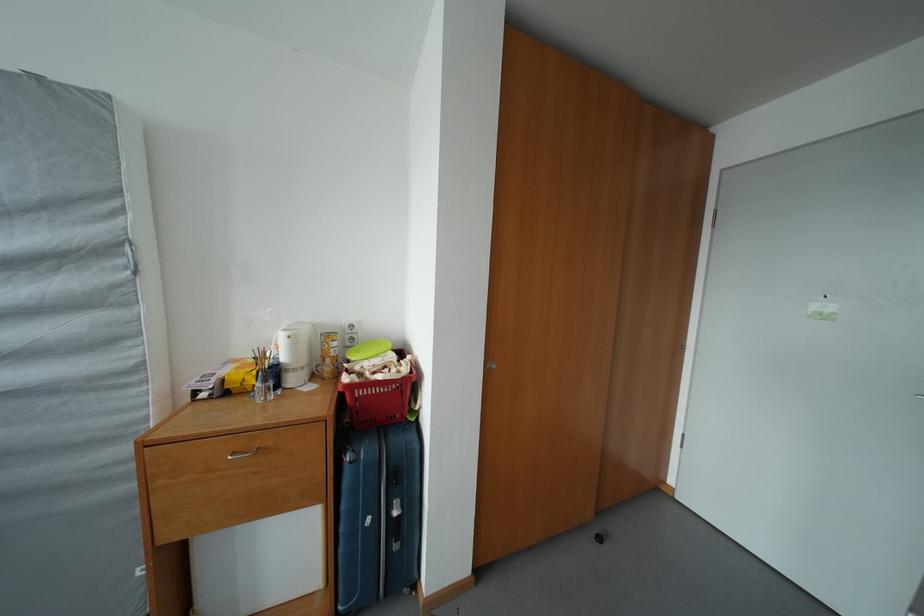
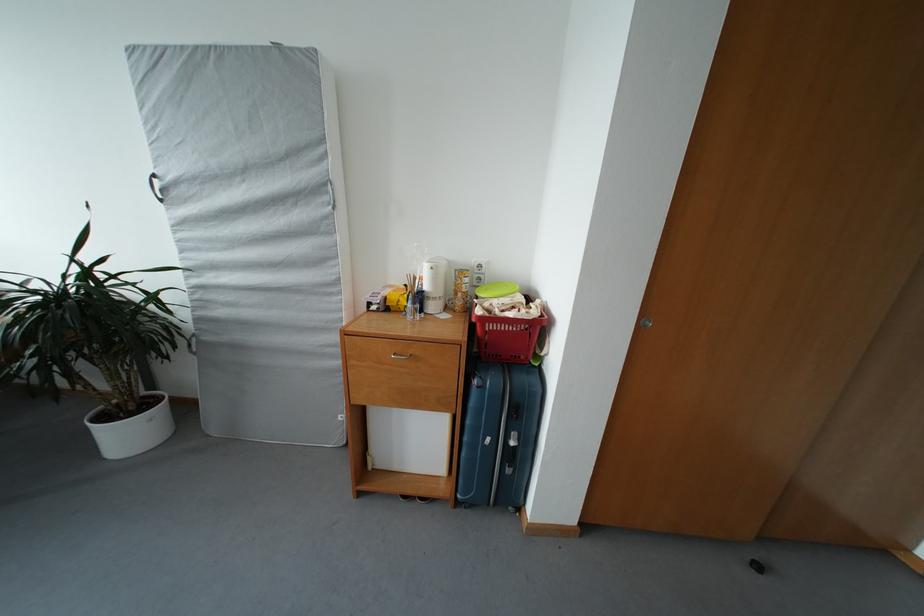
Where in the second image is the point corresponding to (x=331, y=365) from the first image?

(463, 300)